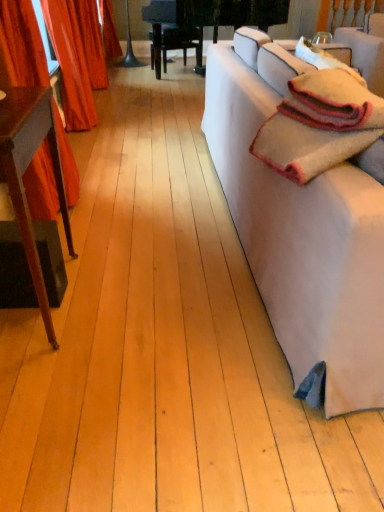
Image resolution: width=384 pixels, height=512 pixels. Identify the location of free space to the right of velvet red curtain at left, the second curtain when ordered from back to front. (122, 205).